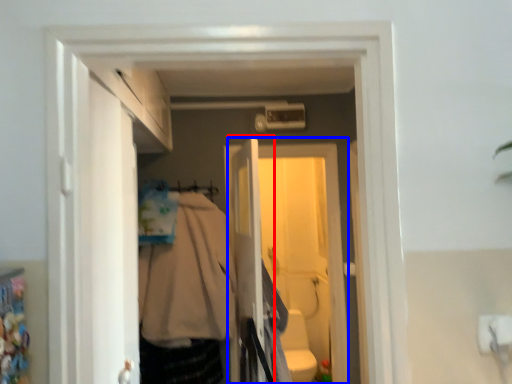
Question: Which of the following is the farthest to the observer, screen door (highlighted by a red box) or screen door (highlighted by a blue box)?

Choices:
 (A) screen door
 (B) screen door

Answer: (B)